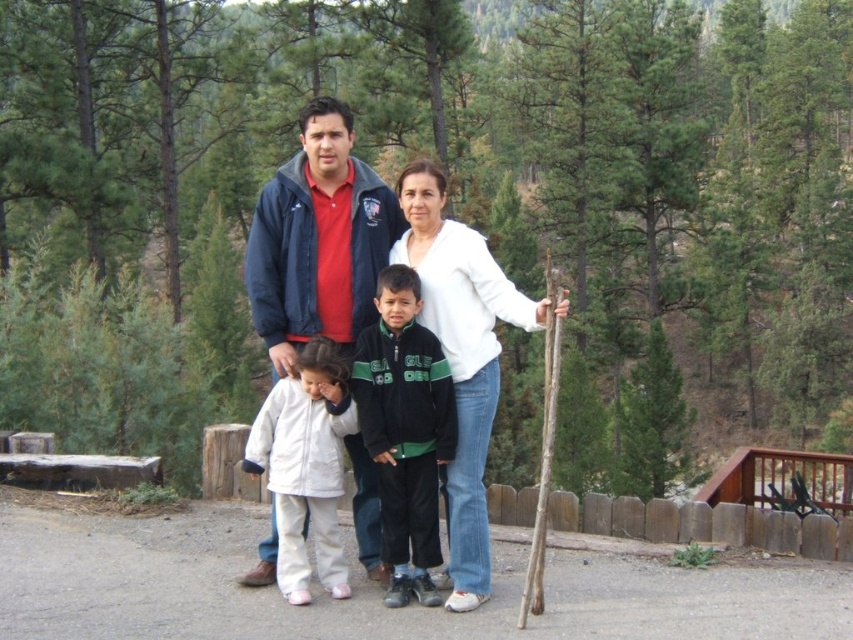
Between matte blue jacket at center and blue denim jacket at center, which one appears on the left side from the viewer's perspective?

blue denim jacket at center

Is matte blue jacket at center smaller than blue denim jacket at center?

Actually, matte blue jacket at center might be larger than blue denim jacket at center.

Locate an element on the screen. The width and height of the screenshot is (853, 640). matte blue jacket at center is located at coordinates (451, 337).

Identify the location of matte blue jacket at center. This screenshot has height=640, width=853. (451, 337).

Locate an element on the screen. green fleece jacket at center is located at coordinates (405, 429).

Who is more distant from viewer, (x=428, y=333) or (x=289, y=410)?

Point (x=289, y=410)

The image size is (853, 640). What are the coordinates of `green fleece jacket at center` in the screenshot? It's located at (405, 429).

Who is more forward, [276,218] or [401,572]?

Point [401,572]

Who is shorter, blue denim jacket at center or green fleece jacket at center?

blue denim jacket at center

Is point (311, 131) positioned in front of point (450, 445)?

No, it is not.

You are a GUI agent. You are given a task and a screenshot of the screen. Output one action in this format:
    pyautogui.click(x=<x>, y=<y>)
    Task: Click on the blue denim jacket at center
    Image resolution: width=853 pixels, height=640 pixels.
    Given the screenshot: What is the action you would take?
    pyautogui.click(x=318, y=240)